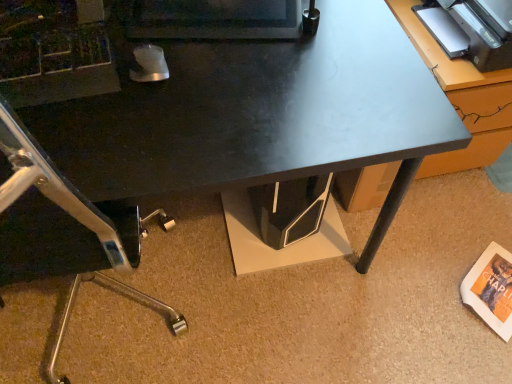
The height and width of the screenshot is (384, 512). In order to click on free space in front of metallic gray table at upper right in this screenshot , I will do [433, 224].